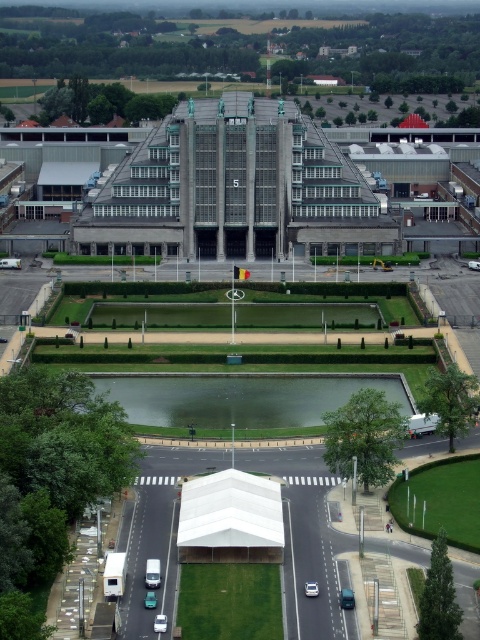
You are a tour guide explaining the historical building to visitors. You mention the teal matte car at center and the metallic silver car at lower center parked in front of the garden. Which car is larger in size?

The teal matte car at center is bigger than the metallic silver car at lower center.

You are standing at the entrance of the building and want to park your car. You see a metallic silver van at center and a white glossy car at center. Which vehicle is closer to you?

The metallic silver van at center is closer to you because it is further to the viewer than the white glossy car at center.